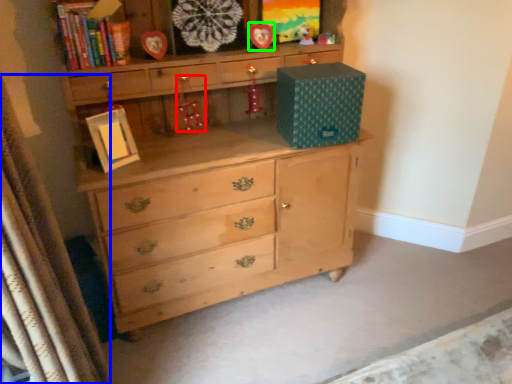
Question: Which object is positioned farthest from toy (highlighted by a red box)? Select from curtain (highlighted by a blue box) and picture frame (highlighted by a green box).

Choices:
 (A) curtain
 (B) picture frame

Answer: (A)